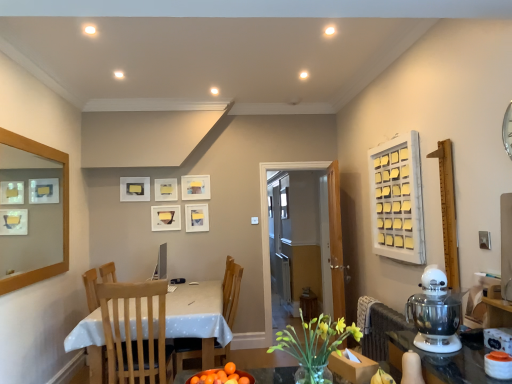
Question: Does point (298, 349) appear closer or farther from the camera than point (281, 168)?

Choices:
 (A) farther
 (B) closer

Answer: (B)

Question: From a real-world perspective, is yellow glass vase at center above or below transparent glass door at center?

Choices:
 (A) below
 (B) above

Answer: (A)

Question: Which object is the closest to the transparent glass door at center?

Choices:
 (A) white wooden frame at upper right, acting as the first window starting from the right
 (B) matte white picture frame at center, arranged as the fifth picture frame when viewed from the left
 (C) light wood chair at center, the 1th chair in the front-to-back sequence
 (D) transparent glass window at center, the first window when ordered from back to front
 (E) orange matte bowl at lower center

Answer: (B)

Question: Which object is positioned closest to the wooden-framed mirror at upper left?

Choices:
 (A) yellow glass vase at center
 (B) transparent glass door at center
 (C) matte white picture frame at upper center, arranged as the fourth picture frame when viewed from the right
 (D) wooden chair at center, which is counted as the second chair, starting from the front
 (E) orange matte bowl at lower center

Answer: (C)